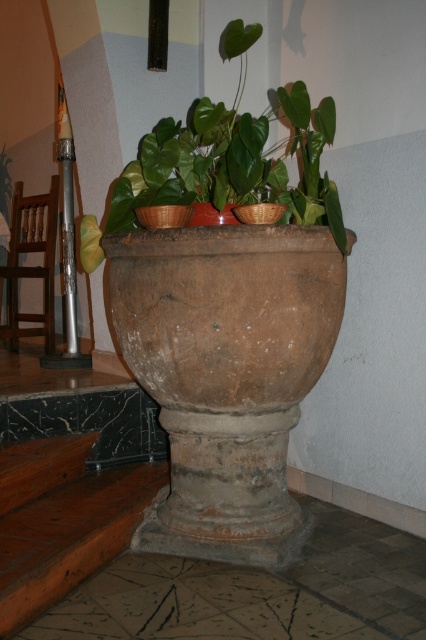
Between point (256, 243) and point (276, 193), which one is positioned behind?

The point (276, 193) is behind.

The width and height of the screenshot is (426, 640). I want to click on brown earthenware vase at center, so click(x=227, y=372).

In order to click on brown earthenware vase at center in this screenshot , I will do `click(227, 372)`.